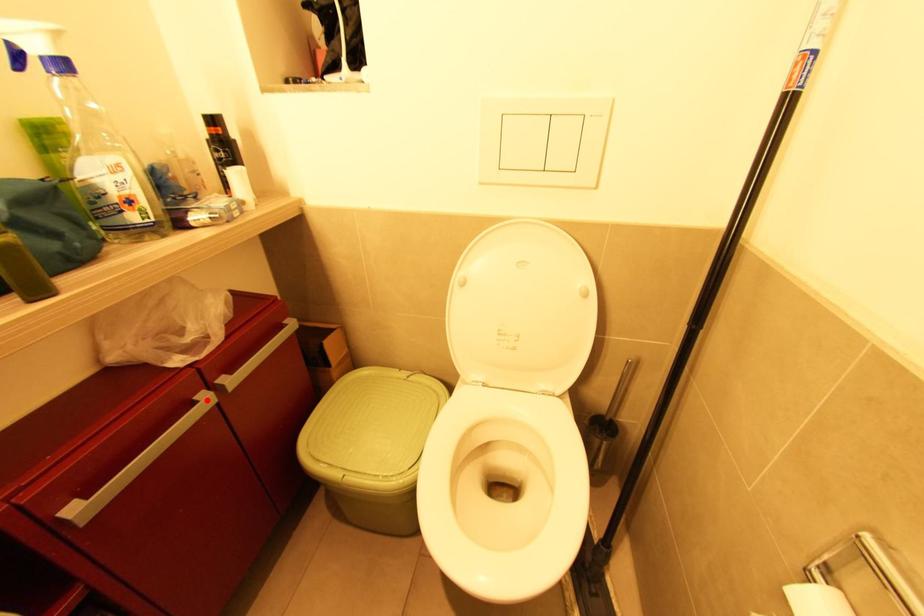
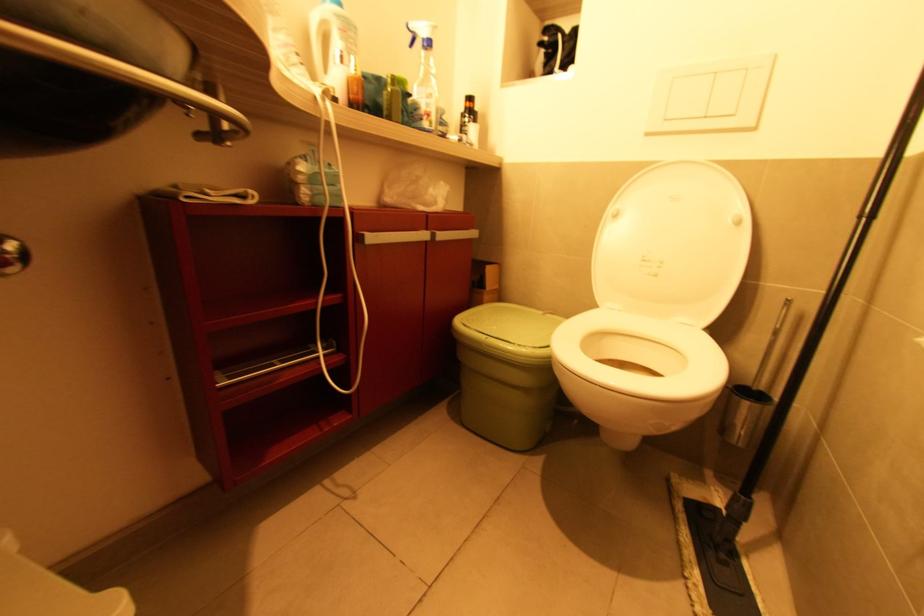
Locate, in the second image, the point that corresponds to the highlighted location in the first image.

(426, 237)